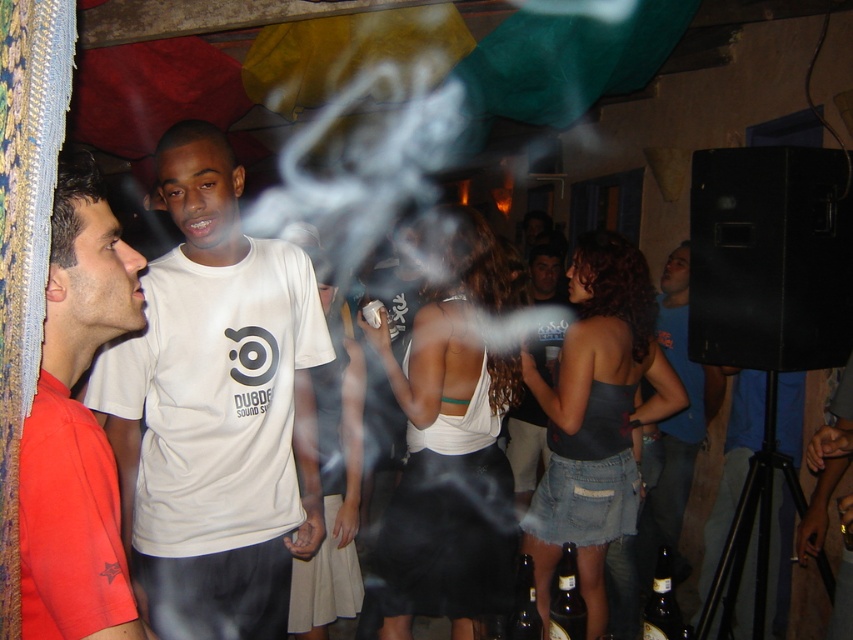
Can you confirm if white matte t-shirt at center is positioned to the right of brown glass bottles at lower center?

In fact, white matte t-shirt at center is to the left of brown glass bottles at lower center.

Does white matte t-shirt at center have a smaller size compared to brown glass bottles at lower center?

No.

Is point (148, 557) more distant than point (531, 608)?

No, it is not.

Image resolution: width=853 pixels, height=640 pixels. Find the location of `white matte t-shirt at center`. white matte t-shirt at center is located at coordinates (215, 410).

Can you confirm if matte red shirt at left is positioned to the right of brown glass bottle at lower right?

In fact, matte red shirt at left is to the left of brown glass bottle at lower right.

Who is more forward, (44, 568) or (669, 630)?

Positioned in front is point (44, 568).

I want to click on matte red shirt at left, so click(x=76, y=426).

Identify the location of white t-shirt at center. Image resolution: width=853 pixels, height=640 pixels. pyautogui.click(x=526, y=445).

Does white t-shirt at center lie in front of brown glass bottles at lower center?

No, it is behind brown glass bottles at lower center.

Between point (548, 296) and point (508, 628), which one is positioned behind?

Point (548, 296)

Locate an element on the screen. This screenshot has width=853, height=640. white t-shirt at center is located at coordinates (526, 445).